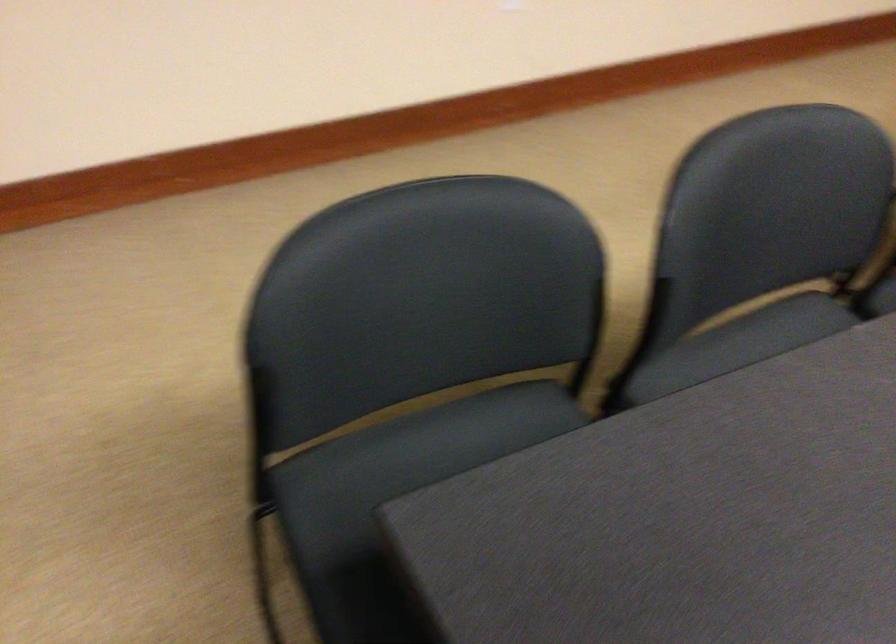
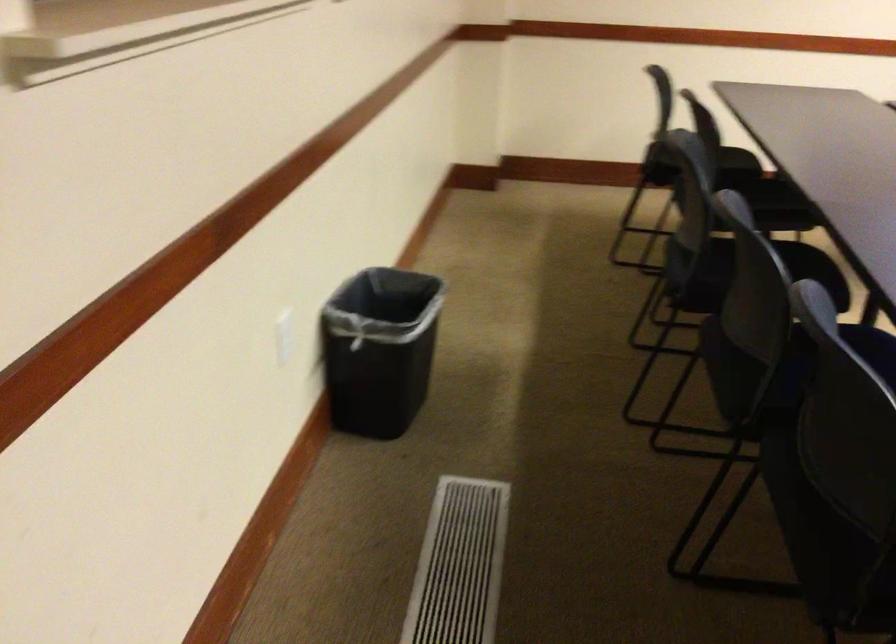
The images are taken continuously from a first-person perspective. In which direction is your viewpoint rotating?

The camera's rotation is toward right-down.